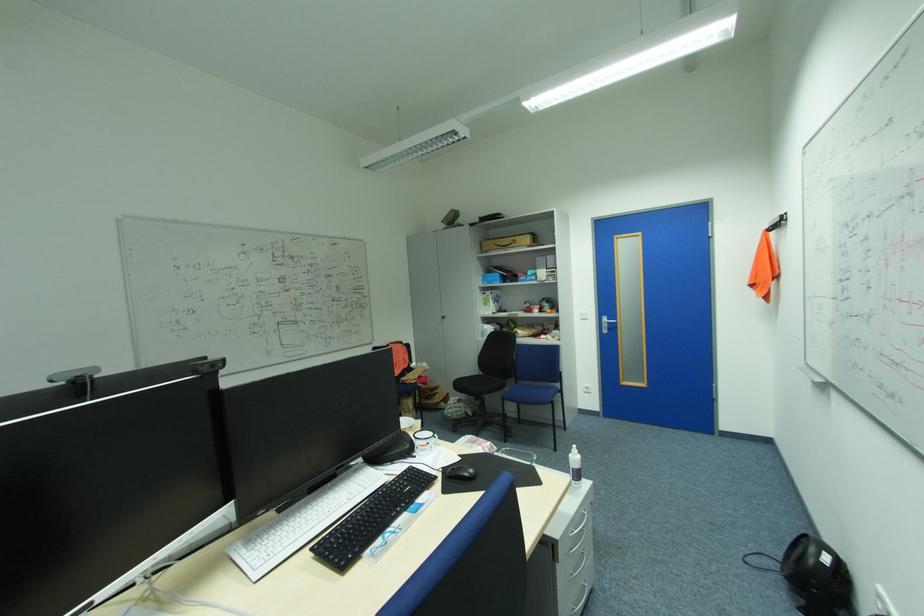
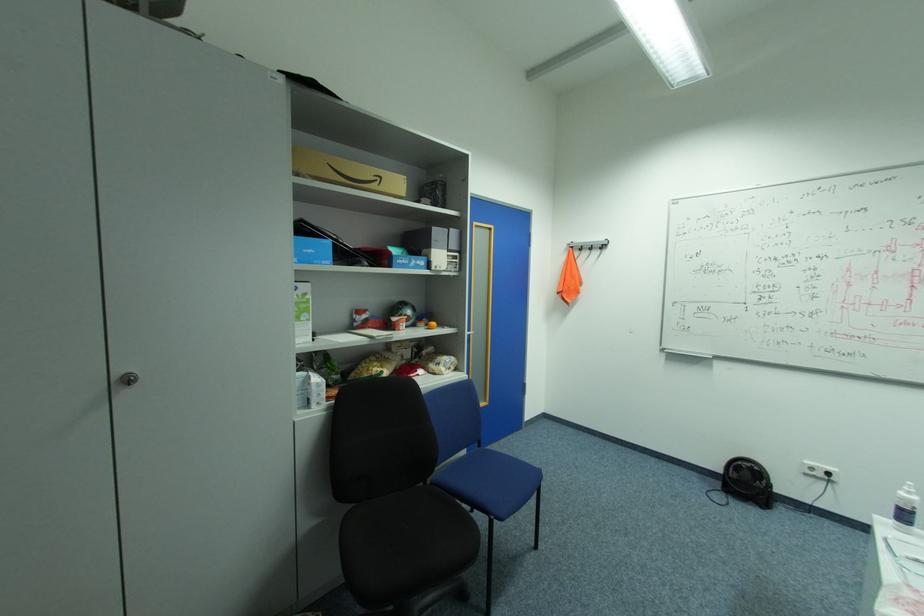
Find the pixel in the second image that matches point (450, 317) in the first image.

(137, 379)